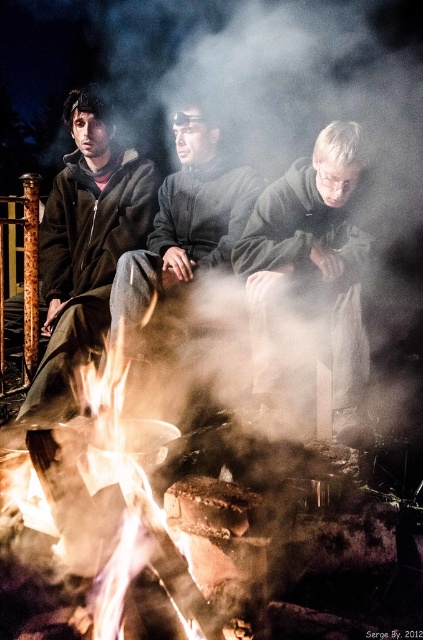
You are a photographer trying to capture a group photo of the matte black jacket at left and the dark gray fleece jacket at center. Since the scene is very smoky, you want to ensure both jackets are visible. Which jacket should you focus on first to ensure it stays in the frame as the smoke clears?

The matte black jacket at left is positioned on the left side of dark gray fleece jacket at center. Since it is on the left, focusing on it first would ensure it remains visible as the smoke clears from that area.

In the scene shown: You are a photographer planning to take a portrait of the two people wearing the matte black jacket at left and the dark gray woolen sweater at center. Since the scene is smoky, you want to ensure both subjects are fully visible. Which clothing item should you focus on first to ensure it stands out against the background?

The matte black jacket at left is taller than the dark gray woolen sweater at center, so focusing on the matte black jacket at left first will ensure it stands out against the dark background due to its height advantage.

You are standing in front of the campfire scene and want to place a small decoration between the two points marked as point (293, 164) and point (192, 198). Which point is closer to you where you should place the decoration?

Point (293, 164) is closer to the viewer than point (192, 198), so you should place the decoration closer to point (293, 164).